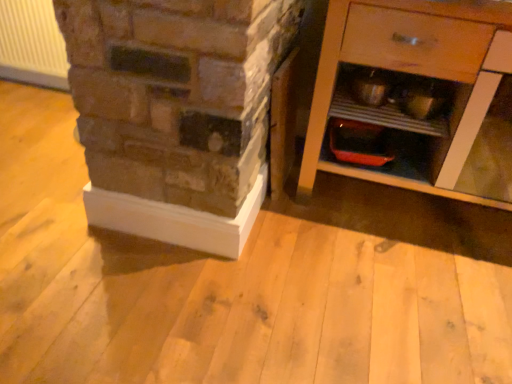
Question: Is wooden cabinet at right wider or thinner than white plastic radiator at upper left?

Choices:
 (A) wide
 (B) thin

Answer: (A)

Question: In terms of size, does wooden cabinet at right appear bigger or smaller than white plastic radiator at upper left?

Choices:
 (A) big
 (B) small

Answer: (A)

Question: Based on their positions, is wooden cabinet at right located to the left or right of white plastic radiator at upper left?

Choices:
 (A) right
 (B) left

Answer: (A)

Question: Looking at their shapes, would you say white plastic radiator at upper left is wider or thinner than wooden cabinet at right?

Choices:
 (A) wide
 (B) thin

Answer: (B)

Question: In terms of size, does white plastic radiator at upper left appear bigger or smaller than wooden cabinet at right?

Choices:
 (A) big
 (B) small

Answer: (B)

Question: Is white plastic radiator at upper left taller or shorter than wooden cabinet at right?

Choices:
 (A) short
 (B) tall

Answer: (A)

Question: From the image's perspective, is white plastic radiator at upper left above or below wooden cabinet at right?

Choices:
 (A) above
 (B) below

Answer: (A)